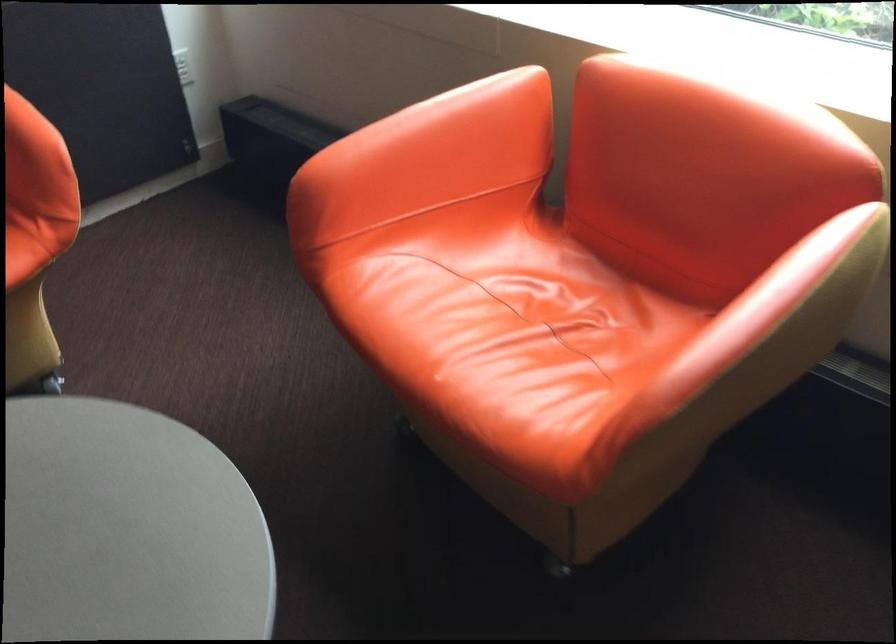
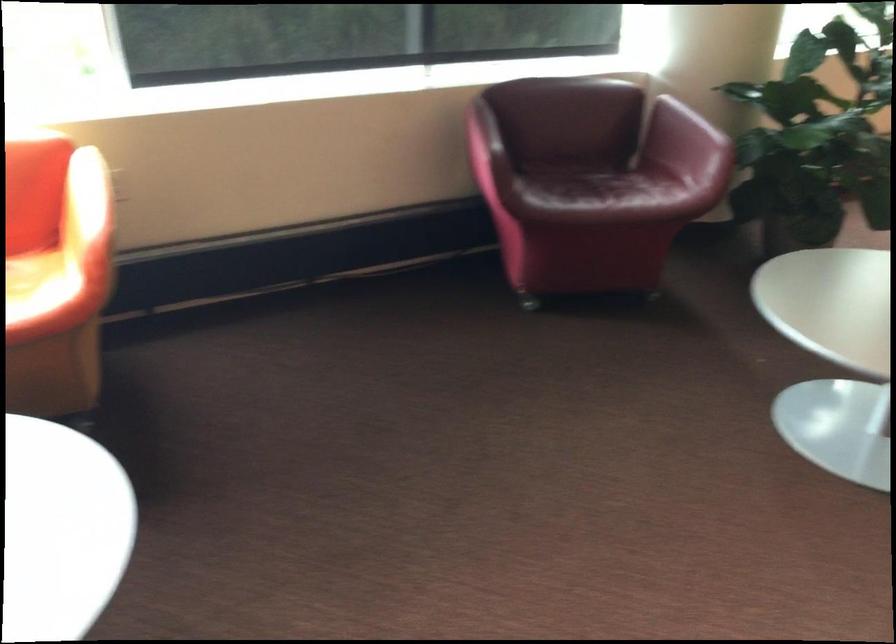
The point at (794, 323) is marked in the first image. Where is the corresponding point in the second image?

(113, 189)